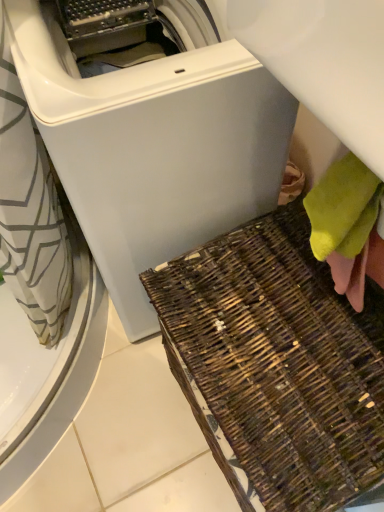
You are a GUI agent. You are given a task and a screenshot of the screen. Output one action in this format:
    pyautogui.click(x=<x>, y=<y>)
    Task: Click on the free point to the left of soft yellow towel at lower right
    The image size is (384, 512).
    Given the screenshot: What is the action you would take?
    pyautogui.click(x=255, y=308)